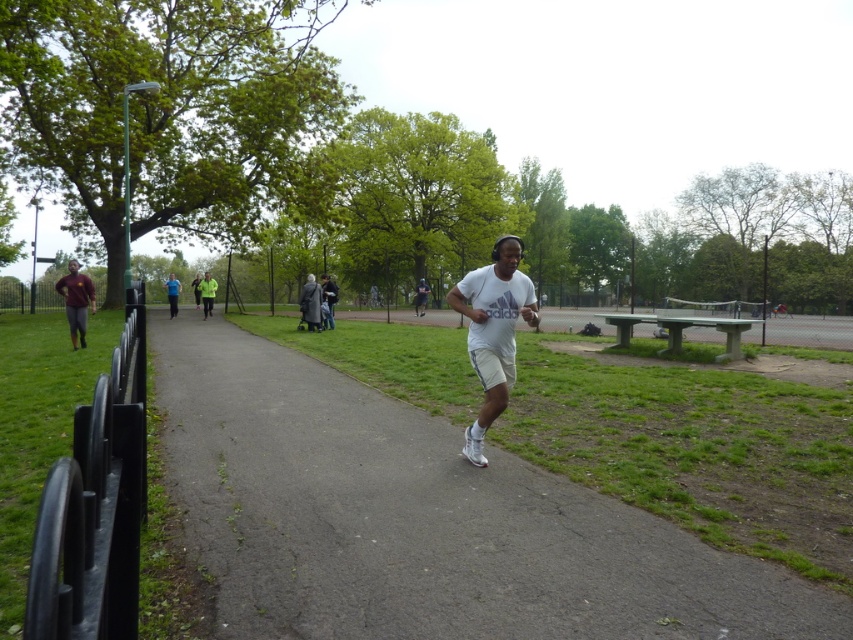
Can you confirm if gray asphalt pavement at center is wider than maroon jersey at left?

Yes.

Who is positioned more to the left, gray asphalt pavement at center or maroon jersey at left?

From the viewer's perspective, maroon jersey at left appears more on the left side.

Between point (315, 468) and point (80, 328), which one is positioned in front?

Point (315, 468) is in front.

Where is `gray asphalt pavement at center`? This screenshot has height=640, width=853. gray asphalt pavement at center is located at coordinates (421, 518).

Is neon green jacket at center below blue fabric shirt at center?

Yes, neon green jacket at center is below blue fabric shirt at center.

Can you confirm if neon green jacket at center is positioned to the left of blue fabric shirt at center?

No, neon green jacket at center is not to the left of blue fabric shirt at center.

Find the location of a particular element. neon green jacket at center is located at coordinates (207, 292).

Which is in front, point (509, 552) or point (213, 289)?

Point (509, 552) is more forward.

Is point (335, 596) positioned after point (212, 308)?

No, it is not.

Where is `gray asphalt pavement at center`? The width and height of the screenshot is (853, 640). gray asphalt pavement at center is located at coordinates (421, 518).